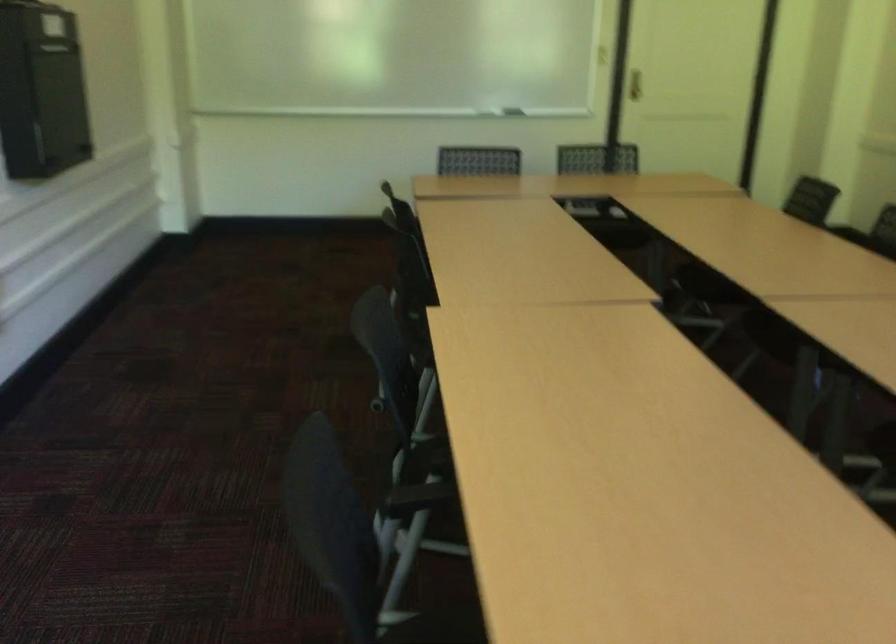
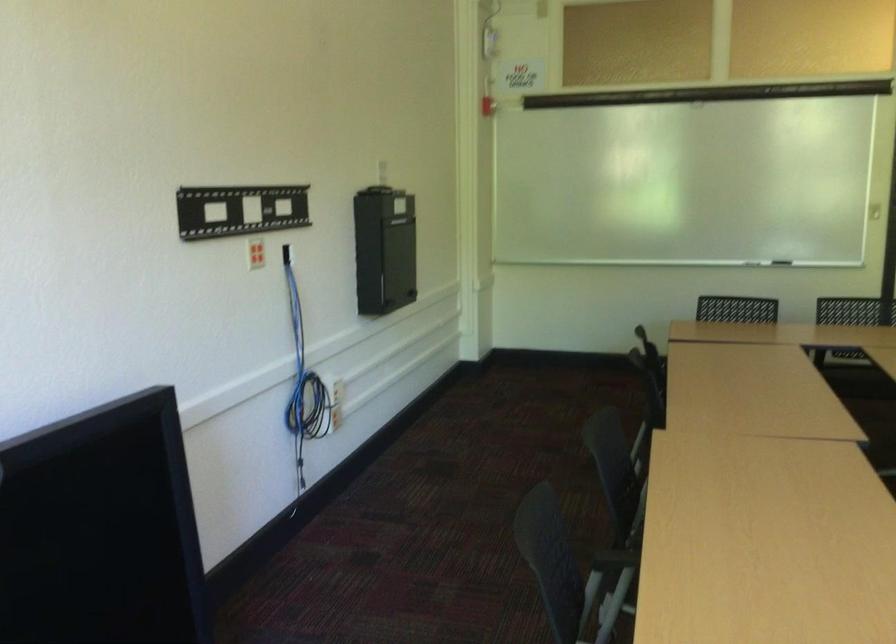
Which direction would the cameraman need to move to produce the second image?

The movement direction of the cameraman is right, backward.